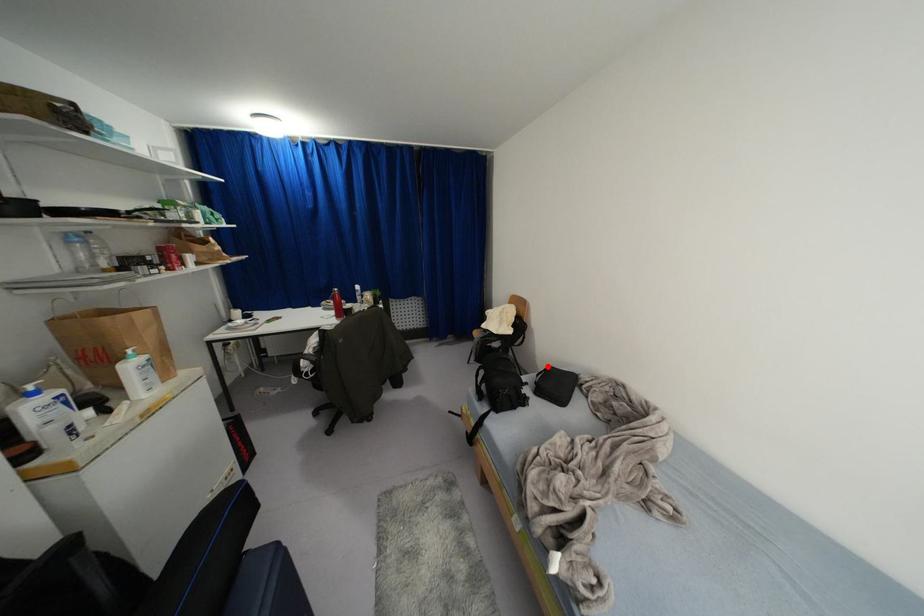
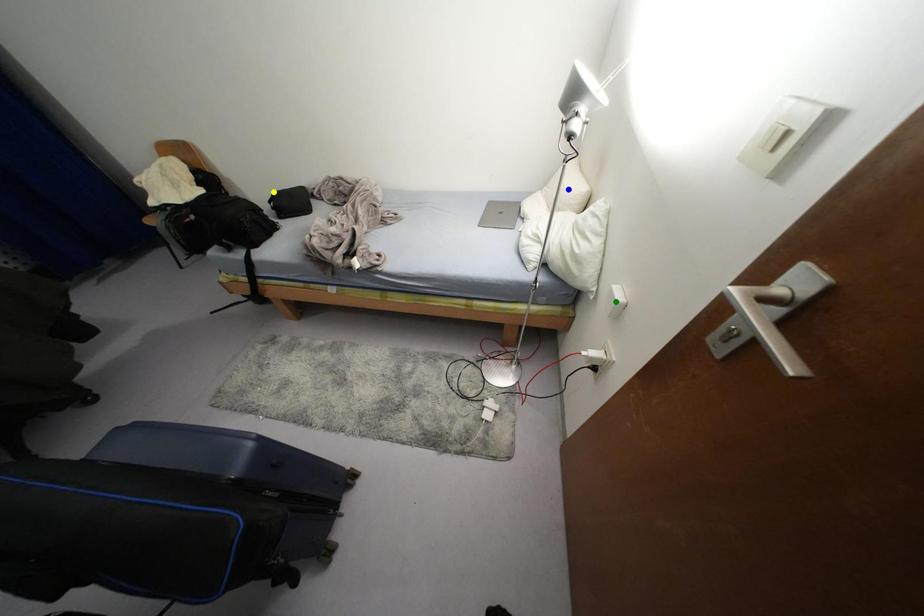
Question: I am providing you with two images of the same scene from different viewpoints. A red point is marked on the first image. You are given multiple points on the second image. Which point in image 2 is actually the same real-world point as the red point in image 1?

Choices:
 (A) blue point
 (B) yellow point
 (C) green point

Answer: (B)